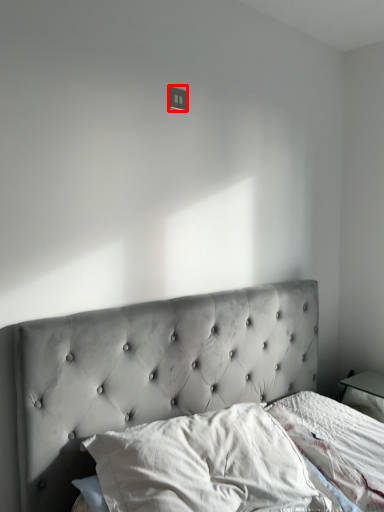
Question: In this image, where is electric outlet (annotated by the red box) located relative to pillow?

Choices:
 (A) left
 (B) right

Answer: (A)